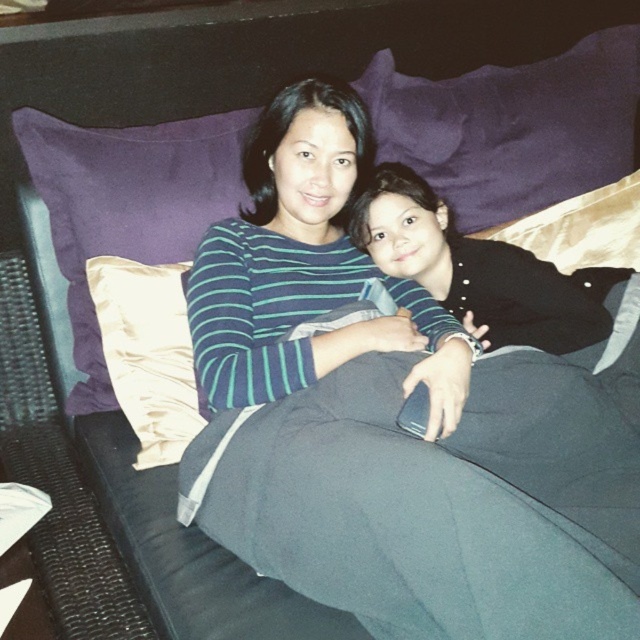
You are designing a seating arrangement for a photo shoot and need to ensure that the two subjects can comfortably sit side by side on the couch. Given the presence of the satin cushion at upper left and the satin beige pillow at left, which of these two items would you adjust to create more space between the two people?

The satin cushion at upper left is much taller than the satin beige pillow at left, so adjusting the taller satin cushion at upper left would create more space between the two people.